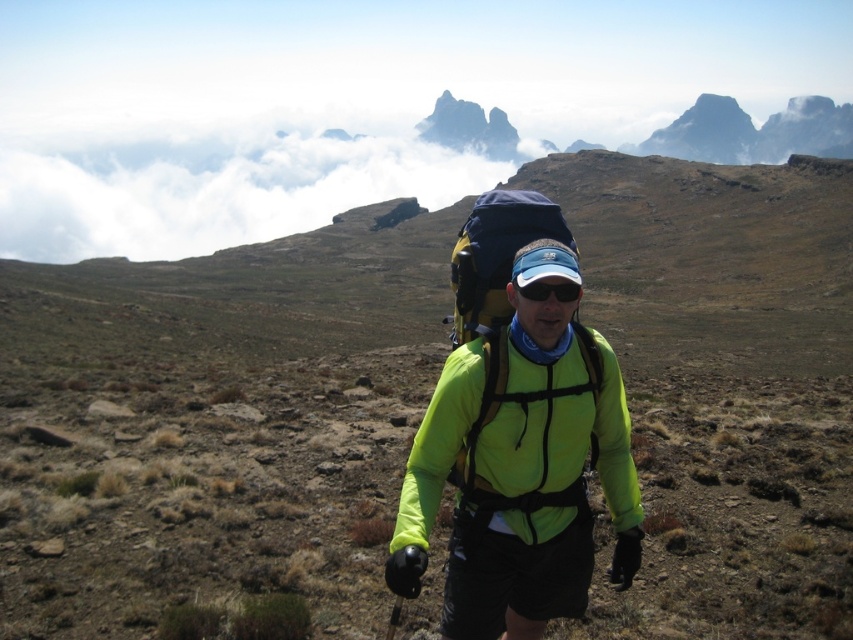
This screenshot has height=640, width=853. Find the location of `white fluffy cloud at upper center`. white fluffy cloud at upper center is located at coordinates (244, 188).

The image size is (853, 640). What do you see at coordinates (244, 188) in the screenshot?
I see `white fluffy cloud at upper center` at bounding box center [244, 188].

Find the location of a particular element. Image resolution: width=853 pixels, height=640 pixels. white fluffy cloud at upper center is located at coordinates (244, 188).

Which is more to the right, white fluffy cloud at upper center or black matte goggles at center?

black matte goggles at center is more to the right.

Between white fluffy cloud at upper center and black matte goggles at center, which one has more height?

white fluffy cloud at upper center is taller.

Does point (325, 200) lie behind point (521, 292)?

Yes.

Find the location of a particular element. The height and width of the screenshot is (640, 853). white fluffy cloud at upper center is located at coordinates pyautogui.click(x=244, y=188).

Does neon green fabric jacket at center have a lesser height compared to black matte goggles at center?

Incorrect, neon green fabric jacket at center's height does not fall short of black matte goggles at center's.

Which is more to the left, neon green fabric jacket at center or black matte goggles at center?

neon green fabric jacket at center

Between point (523, 529) and point (535, 280), which one is positioned in front?

Point (535, 280) is more forward.

Locate an element on the screen. neon green fabric jacket at center is located at coordinates pyautogui.click(x=520, y=467).